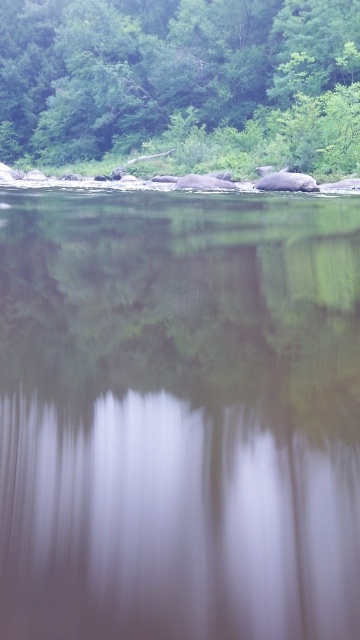
Question: Is the position of transparent glass lake at center less distant than that of green leafy tree at upper center?

Choices:
 (A) yes
 (B) no

Answer: (A)

Question: Is transparent glass lake at center below green leafy tree at upper center?

Choices:
 (A) no
 (B) yes

Answer: (B)

Question: Which of the following is the farthest from the observer?

Choices:
 (A) green leafy tree at upper center
 (B) transparent glass lake at center

Answer: (A)

Question: Which point is closer to the camera?

Choices:
 (A) green leafy tree at upper center
 (B) transparent glass lake at center

Answer: (B)

Question: Does transparent glass lake at center appear under green leafy tree at upper center?

Choices:
 (A) no
 (B) yes

Answer: (B)